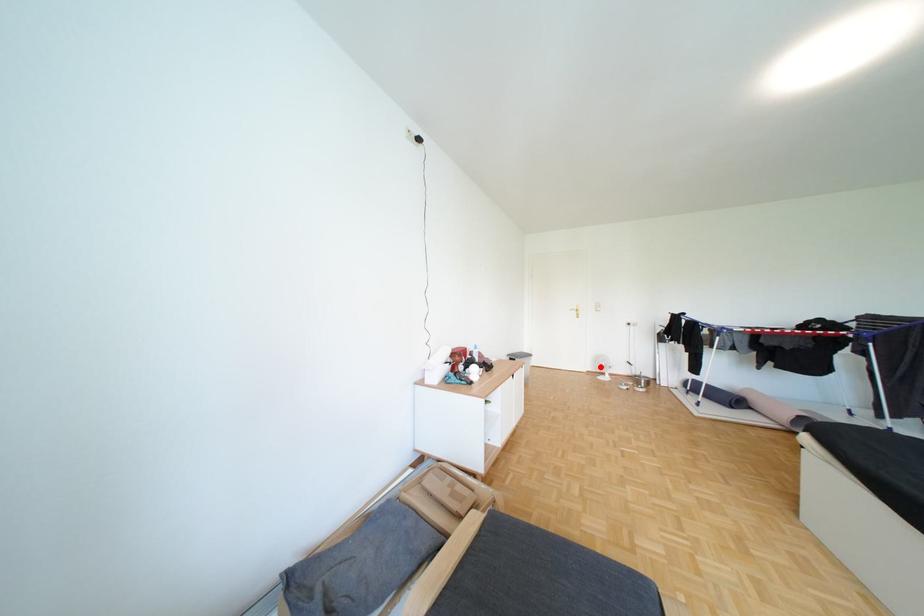
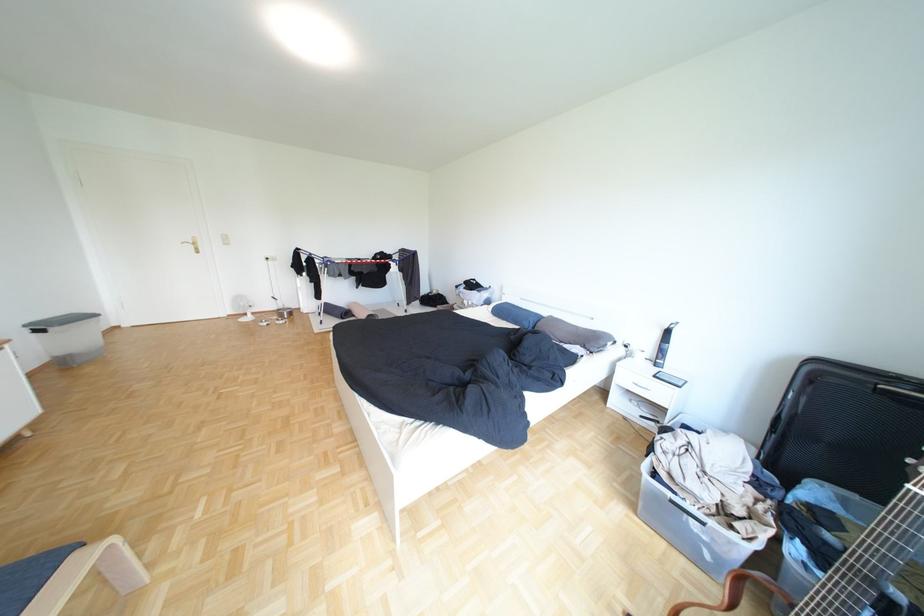
Question: I am providing you with two images of the same scene from different viewpoints. A red point is marked on the first image. Is the red point's position out of view in image 2?

Choices:
 (A) Yes
 (B) No

Answer: (B)